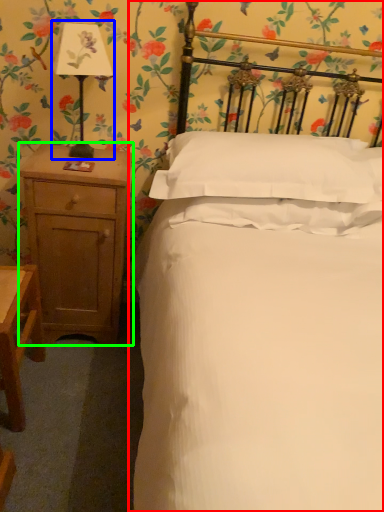
Question: Which object is positioned closest to bed (highlighted by a red box)? Select from bedside lamp (highlighted by a blue box) and nightstand (highlighted by a green box).

Choices:
 (A) bedside lamp
 (B) nightstand

Answer: (B)